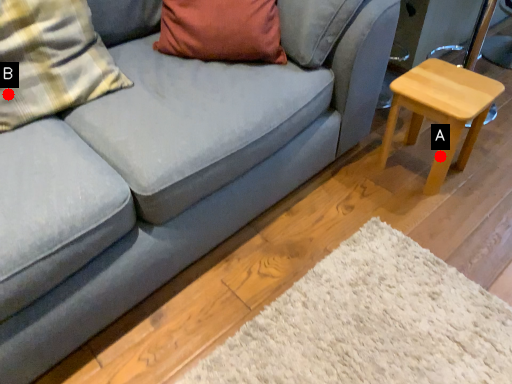
Question: Two points are circled on the image, labeled by A and B beside each circle. Which point is closer to the camera?

Choices:
 (A) A is closer
 (B) B is closer

Answer: (B)